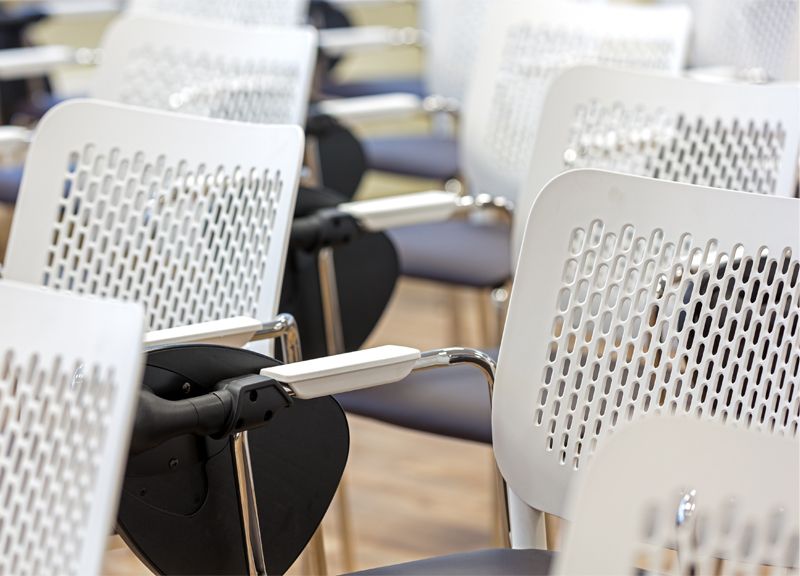
At what (x,y) coordinates should I click in order to perform the action: click on arm rests. Please return your answer as a coordinate pair (x, y). Looking at the image, I should click on (181, 333), (357, 372), (410, 213), (381, 108), (364, 35), (41, 59), (10, 136), (78, 7).